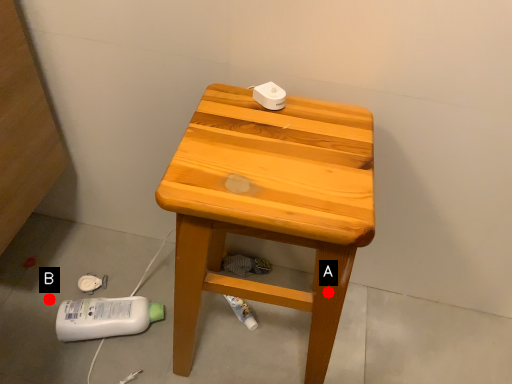
Question: Two points are circled on the image, labeled by A and B beside each circle. Which of the following is the closest to the observer?

Choices:
 (A) A is closer
 (B) B is closer

Answer: (A)